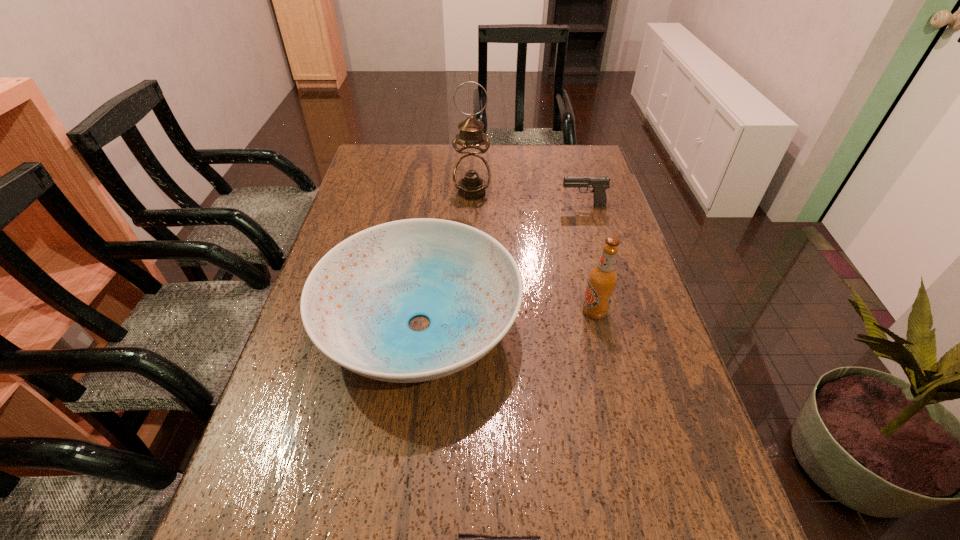
Where is `oil lamp`? This screenshot has height=540, width=960. oil lamp is located at coordinates (471, 175).

What are the coordinates of `the tallest object` in the screenshot? It's located at [x=471, y=175].

I want to click on beer bottle, so click(x=603, y=278).

Locate an element on the screen. This screenshot has height=540, width=960. dish is located at coordinates (356, 304).

Locate an element on the screen. the second shortest object is located at coordinates (599, 184).

The height and width of the screenshot is (540, 960). In order to click on the second farthest object in this screenshot , I will do `click(599, 184)`.

Find the location of a particular element. vacant space located 0.250m on the front of the tallest object is located at coordinates pos(470,253).

The height and width of the screenshot is (540, 960). Find the location of `vacant space located on the front label of the beer bottle`. vacant space located on the front label of the beer bottle is located at coordinates tap(536, 312).

Find the location of a particular element. Image resolution: width=960 pixels, height=540 pixels. free region located on the front label of the beer bottle is located at coordinates (527, 312).

I want to click on vacant region located on the front label of the beer bottle, so click(511, 312).